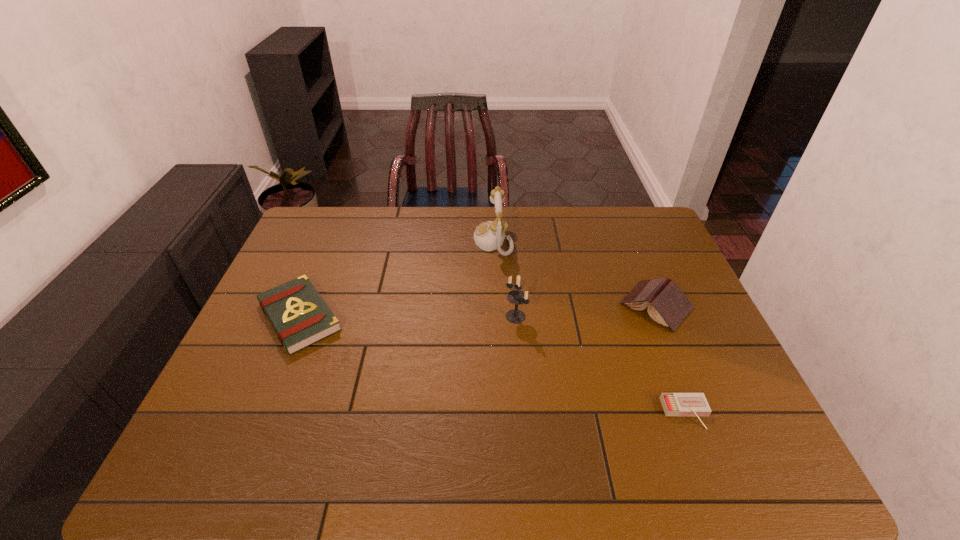
Image resolution: width=960 pixels, height=540 pixels. Find the location of `the farthest object`. the farthest object is located at coordinates tap(490, 235).

At what (x,y) coordinates should I click in order to perform the action: click on candle holder. Please return your answer as a coordinate pair (x, y). Image resolution: width=960 pixels, height=540 pixels. Looking at the image, I should click on (517, 297).

Identify the location of the taller book. (668, 305).

Image resolution: width=960 pixels, height=540 pixels. What are the coordinates of `the third shortest object` in the screenshot? It's located at [x=668, y=305].

Identify the location of the shorter book. (300, 317).

Locate an element on the screen. The image size is (960, 540). the left book is located at coordinates (300, 317).

Identify the location of the nearest object. The height and width of the screenshot is (540, 960). (674, 404).

The image size is (960, 540). Identify the location of matchbox. (674, 404).

The height and width of the screenshot is (540, 960). What are the coordinates of `vacant space situated on the dial of the telephone` in the screenshot? It's located at (426, 241).

Where is `free location located 0.050m on the dial of the telephone`? free location located 0.050m on the dial of the telephone is located at coordinates (459, 241).